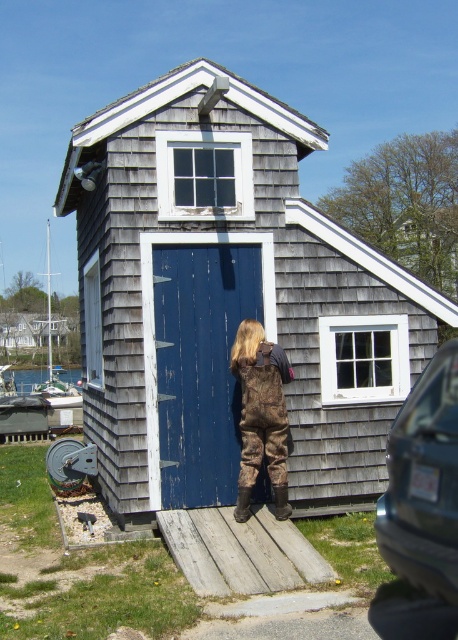
You are a painter who needs to decide which item to paint first between the gray shingled hut at center and the blue weathered wood door at center. Since you want to start with the larger object, which one should you choose?

The gray shingled hut at center has a greater width than the blue weathered wood door at center, so you should paint the gray shingled hut at center first.

You are standing in front of the boathouse and need to locate both the blue weathered wood door at center and the camouflage waders at center. Which object is positioned to the right side of the other?

The camouflage waders at center are to the right of the blue weathered wood door at center.

You are standing in front of the boathouse and need to determine if the camouflage waders at center can be stored inside the blue weathered wood door at center. Can they fit vertically?

The blue weathered wood door at center is taller than camouflage waders at center, so yes, the camouflage waders at center can be stored vertically inside the door since they are shorter in height.